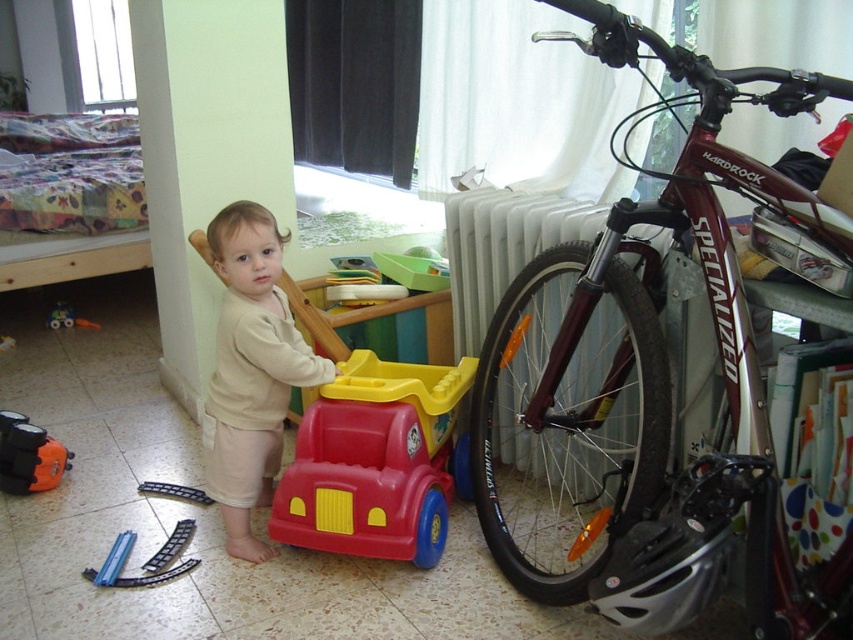
Question: Estimate the real-world distances between objects in this image. Which object is farther from the metallic silver radiator at right?

Choices:
 (A) rubberized plastic toy car at center
 (B) orange matte toy car at lower left

Answer: (B)

Question: Which point is farther to the camera?

Choices:
 (A) rubberized plastic toy car at center
 (B) shiny metallic bicycle at right
 (C) blue plastic toy car at lower left

Answer: (C)

Question: Does shiny metallic bicycle at right appear under beige soft toddler at center?

Choices:
 (A) no
 (B) yes

Answer: (A)

Question: Does beige soft toddler at center have a larger size compared to blue plastic toy car at lower left?

Choices:
 (A) no
 (B) yes

Answer: (B)

Question: Is shiny metallic bicycle at right above rubberized plastic toy car at center?

Choices:
 (A) no
 (B) yes

Answer: (B)

Question: Which object is closer to the camera taking this photo?

Choices:
 (A) beige soft toddler at center
 (B) metallic silver radiator at right

Answer: (B)